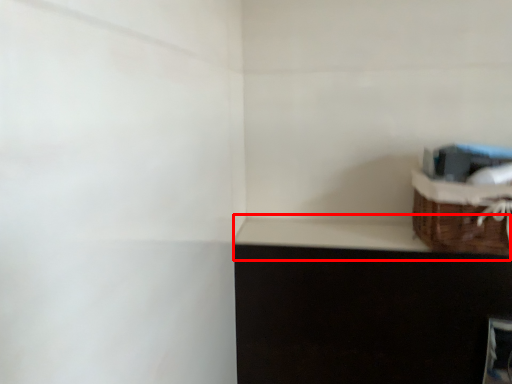
Question: From the image's perspective, what is the correct spatial positioning of window sill (annotated by the red box) in reference to basket?

Choices:
 (A) above
 (B) below

Answer: (B)